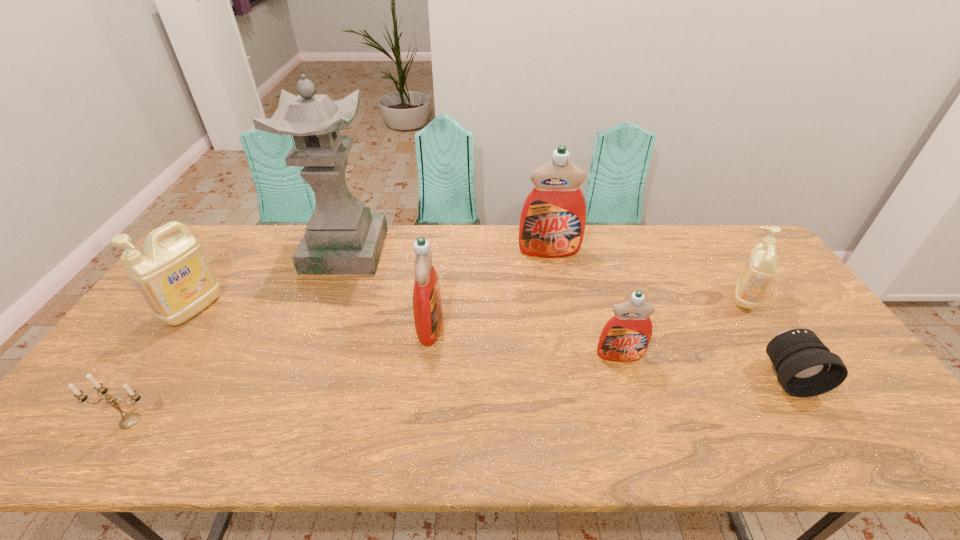
Locate an element on the screen. the smallest red detergent is located at coordinates (626, 336).

Image resolution: width=960 pixels, height=540 pixels. I want to click on the nearest object, so click(x=129, y=420).

Where is `the second shortest object`? the second shortest object is located at coordinates (129, 420).

Find the location of a particular element. The height and width of the screenshot is (540, 960). telephoto lens is located at coordinates (805, 366).

In order to click on black telephoto lens in this screenshot , I will do `click(805, 366)`.

Locate an element on the screen. The width and height of the screenshot is (960, 540). vacant space located 0.350m at the front opening of the third object from left to right is located at coordinates (485, 251).

Locate an element on the screen. The image size is (960, 540). vacant space situated 0.350m on the front surface of the tallest detergent is located at coordinates (566, 339).

Identify the location of free space located on the front surface of the second biggest red detergent. [553, 325].

At what (x,y) coordinates should I click in order to perform the action: click on free region located on the right of the left beige detergent. Please return your answer as a coordinate pair (x, y). Image resolution: width=960 pixels, height=540 pixels. Looking at the image, I should click on [x=265, y=309].

Find the location of a particular element. free spot located on the left of the smaller beige detergent is located at coordinates (641, 298).